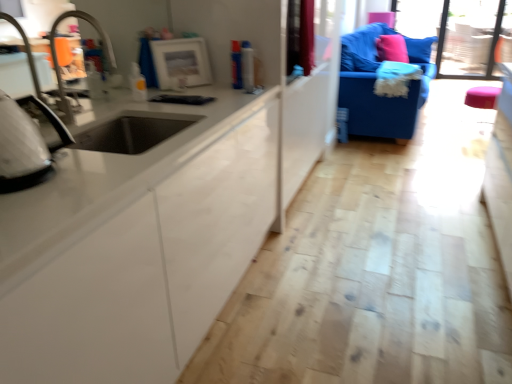
Question: Is matte white frame at upper center, which ranks as the 2th appliance in front-to-back order, spatially inside pink fabric pillow at upper right, or outside of it?

Choices:
 (A) outside
 (B) inside

Answer: (A)

Question: From a real-world perspective, relative to pink fabric pillow at upper right, is matte white frame at upper center, arranged as the 1th appliance when viewed from the top, vertically above or below?

Choices:
 (A) below
 (B) above

Answer: (B)

Question: Which object is the farthest from the transparent glass window screen at upper right?

Choices:
 (A) brushed metal faucet at left
 (B) white glossy iron at left, which ranks as the 2th appliance in top-to-bottom order
 (C) blue fabric couch at upper right
 (D) pink fabric pillow at upper right
 (E) matte white frame at upper center, placed as the second appliance when sorted from left to right

Answer: (B)

Question: Which object is the farthest from the matte white frame at upper center, placed as the second appliance when sorted from left to right?

Choices:
 (A) white glossy iron at left, the first appliance from the left
 (B) transparent glass window screen at upper right
 (C) blue fabric couch at upper right
 (D) brushed metal faucet at left
 (E) pink fabric pillow at upper right

Answer: (B)